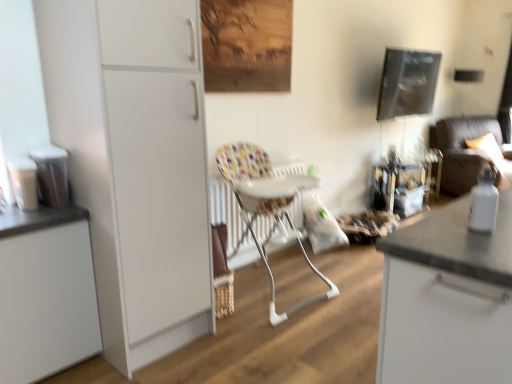
You are a GUI agent. You are given a task and a screenshot of the screen. Output one action in this format:
    pyautogui.click(x=<x>, y=<y>)
    Task: Click on the vacant space in front of satin silver trash can at left, the 2th appliance from the left
    This screenshot has height=384, width=512.
    Given the screenshot: What is the action you would take?
    pyautogui.click(x=45, y=218)